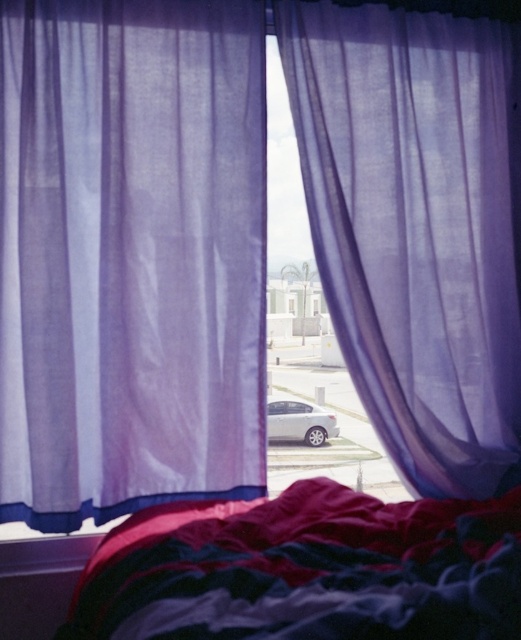
Based on the photo, you are an interior designer assessing the window setup. You need to determine which curtain, the sheer purple curtain at left or the translucent purple curtain at center, reaches closer to the floor. Based on the scene, which one is it?

The sheer purple curtain at left is much taller than the translucent purple curtain at center, so the sheer purple curtain at left reaches closer to the floor.